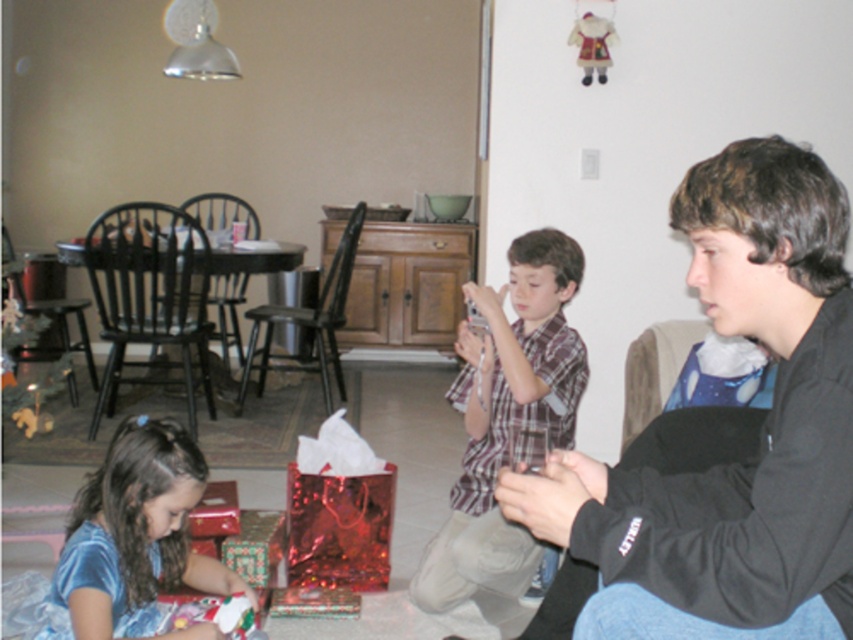
Is point (294, 355) more distant than point (236, 273)?

That is True.

Locate an element on the screen. black wood chair at center is located at coordinates (308, 323).

I want to click on black wood chair at center, so click(x=308, y=323).

Find the location of a particular element. The image size is (853, 640). black wood chair at center is located at coordinates (308, 323).

Which is below, plaid fabric shirt at center or metallic black armchair at left?

plaid fabric shirt at center is below.

Does point (521, 260) come farther from viewer compared to point (3, 264)?

No.

Image resolution: width=853 pixels, height=640 pixels. Describe the element at coordinates (505, 417) in the screenshot. I see `plaid fabric shirt at center` at that location.

Identify the location of plaid fabric shirt at center. (x=505, y=417).

What do you see at coordinates (763, 429) in the screenshot?
I see `black matte jacket at lower right` at bounding box center [763, 429].

Can you confirm if black matte jacket at lower right is positioned to the right of metallic black armchair at left?

Correct, you'll find black matte jacket at lower right to the right of metallic black armchair at left.

Is point (520, 477) in front of point (33, 307)?

That is True.

What are the coordinates of `black matte jacket at lower right` in the screenshot? It's located at (763, 429).